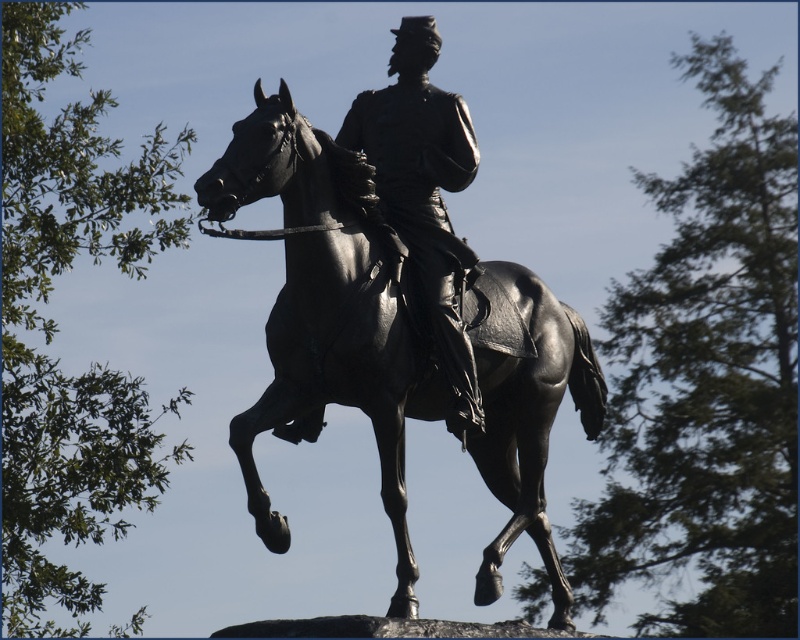
Question: Which point is farther to the camera?

Choices:
 (A) (520, 420)
 (B) (456, 172)

Answer: (A)

Question: Can you confirm if polished bronze horse at center is thinner than polished bronze statue at center?

Choices:
 (A) yes
 (B) no

Answer: (B)

Question: Is polished bronze horse at center to the right of polished bronze statue at center from the viewer's perspective?

Choices:
 (A) no
 (B) yes

Answer: (B)

Question: Is polished bronze horse at center above polished bronze statue at center?

Choices:
 (A) no
 (B) yes

Answer: (A)